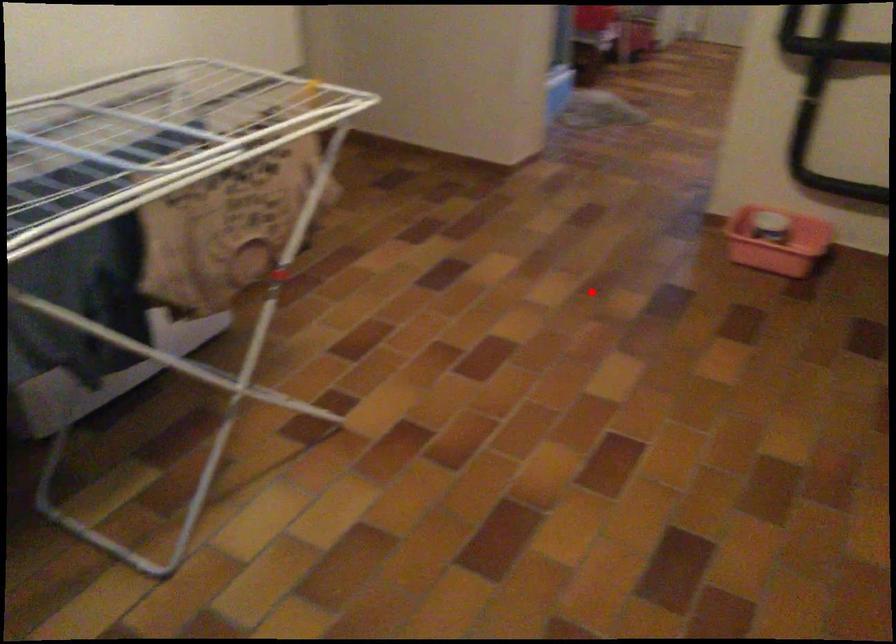
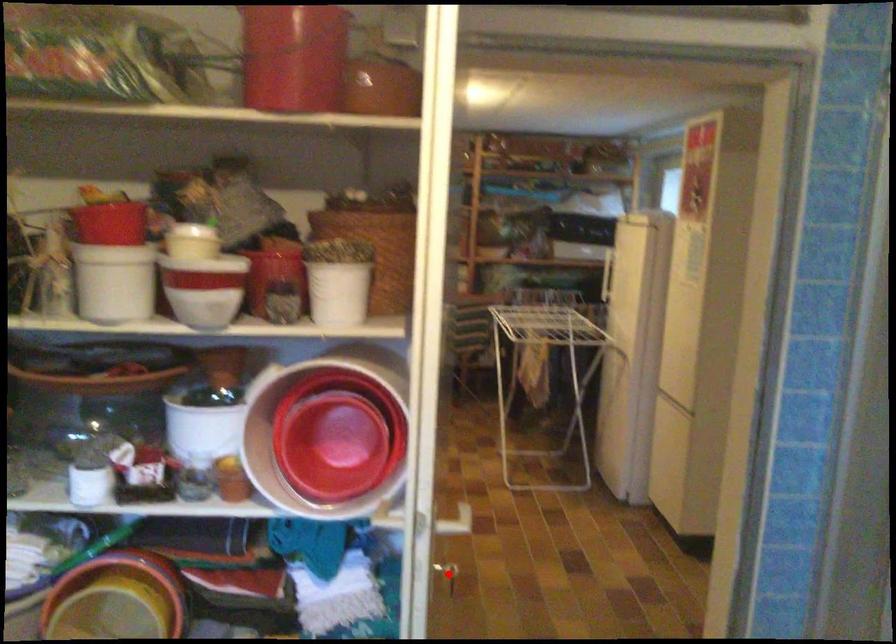
I am providing you with two images of the same scene from different viewpoints. A red point is marked on the first image and another point is marked on the second image. Do the highlighted points in image1 and image2 indicate the same real-world spot?

Yes